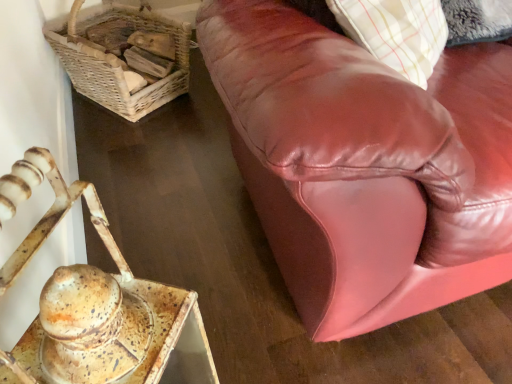
Question: Could shiny brown leather couch at upper right be considered to be inside rusty metal tray at lower left?

Choices:
 (A) yes
 (B) no

Answer: (B)

Question: Is rusty metal tray at lower left to the left of shiny brown leather couch at upper right from the viewer's perspective?

Choices:
 (A) yes
 (B) no

Answer: (A)

Question: Is rusty metal tray at lower left completely or partially outside of shiny brown leather couch at upper right?

Choices:
 (A) no
 (B) yes

Answer: (B)

Question: Is rusty metal tray at lower left turned away from shiny brown leather couch at upper right?

Choices:
 (A) yes
 (B) no

Answer: (B)

Question: From the image's perspective, is rusty metal tray at lower left located above shiny brown leather couch at upper right?

Choices:
 (A) yes
 (B) no

Answer: (B)

Question: Is rusty metal tray at lower left shorter than shiny brown leather couch at upper right?

Choices:
 (A) no
 (B) yes

Answer: (A)

Question: Is shiny brown leather couch at upper right far away from rusty metal tray at lower left?

Choices:
 (A) no
 (B) yes

Answer: (A)

Question: Considering the relative sizes of shiny brown leather couch at upper right and rusty metal tray at lower left in the image provided, is shiny brown leather couch at upper right bigger than rusty metal tray at lower left?

Choices:
 (A) no
 (B) yes

Answer: (B)

Question: From the image's perspective, is shiny brown leather couch at upper right below rusty metal tray at lower left?

Choices:
 (A) no
 (B) yes

Answer: (A)

Question: Considering the relative positions of shiny brown leather couch at upper right and rusty metal tray at lower left in the image provided, is shiny brown leather couch at upper right to the right of rusty metal tray at lower left from the viewer's perspective?

Choices:
 (A) no
 (B) yes

Answer: (B)

Question: Would you say shiny brown leather couch at upper right is outside rusty metal tray at lower left?

Choices:
 (A) yes
 (B) no

Answer: (A)

Question: Is shiny brown leather couch at upper right directly adjacent to rusty metal tray at lower left?

Choices:
 (A) no
 (B) yes

Answer: (A)

Question: Is woven wicker basket at upper left positioned before rusty metal tray at lower left?

Choices:
 (A) yes
 (B) no

Answer: (B)